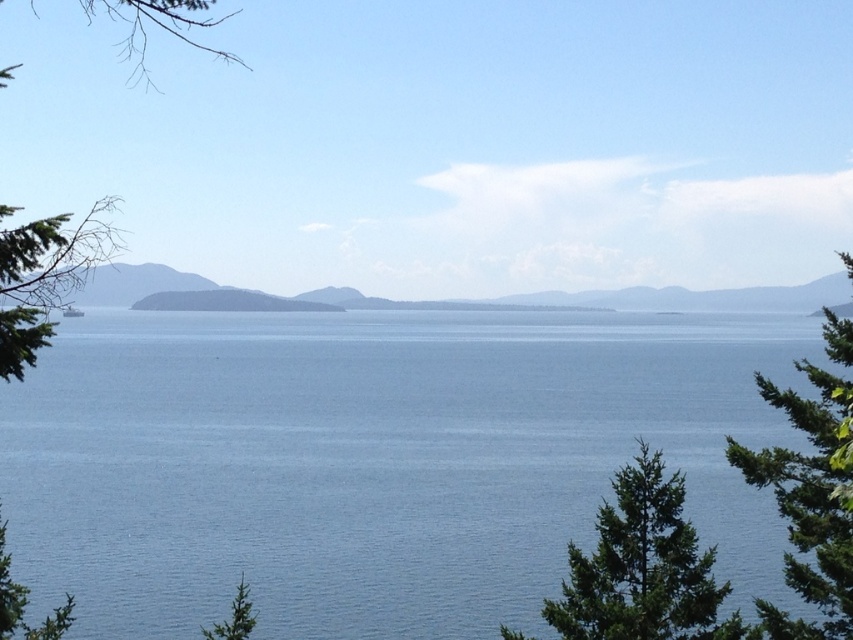
You are standing at the edge of the coastal landscape and want to walk towards the blue water at center. Which direction should you move relative to the green leafy tree at left?

You should move to the right of the green leafy tree at left because the blue water at center is positioned on the right side of it.

You are standing in the coastal landscape scene and want to take a photo of the green leafy tree at left. If your camera can focus on objects up to 10 meters away, will you be able to capture the tree clearly?

The green leafy tree at left is 11.23 meters away from the viewer, which exceeds the camera focus limit of 10 meters. Therefore, the tree will not be in clear focus.